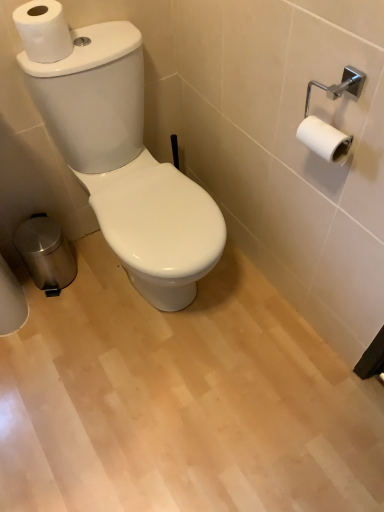
This screenshot has height=512, width=384. I want to click on vacant area located to the right-hand side of polished stainless steel trash bin at lower left, so click(x=96, y=276).